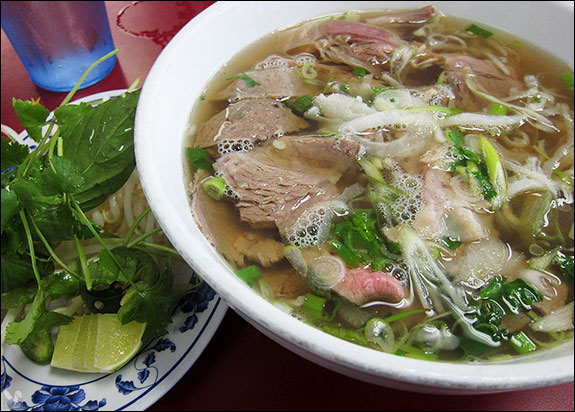
At what (x,y) coordinates should I click in order to perform the action: click on white bowl. Please return your answer as a coordinate pair (x, y). The width and height of the screenshot is (575, 412). Looking at the image, I should click on (159, 97).